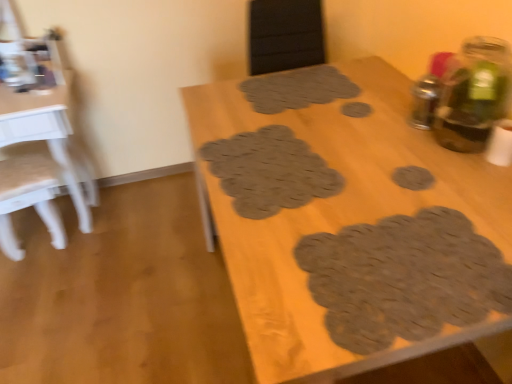
Question: Does brown textured mat at bottom right, marked as the fifth footprint in a top-to-bottom arrangement, appear on the left side of brown textured placemats at center, which is the 1th table from right to left?

Choices:
 (A) no
 (B) yes

Answer: (A)

Question: Does brown textured mat at bottom right, which is the 1th footprint in front-to-back order, have a lesser width compared to brown textured placemats at center, which is the 1th table from right to left?

Choices:
 (A) yes
 (B) no

Answer: (A)

Question: From a real-world perspective, is brown textured mat at bottom right, which is the fifth footprint from back to front, positioned under brown textured placemats at center, which appears as the 2th table when viewed from the left, based on gravity?

Choices:
 (A) yes
 (B) no

Answer: (B)

Question: From the image's perspective, would you say brown textured mat at bottom right, arranged as the first footprint when ordered from the bottom, is shown under brown textured placemats at center, which is the 1th table from right to left?

Choices:
 (A) yes
 (B) no

Answer: (B)

Question: Is brown textured mat at bottom right, arranged as the first footprint when ordered from the bottom, further to camera compared to brown textured placemats at center, which appears as the 2th table when viewed from the left?

Choices:
 (A) no
 (B) yes

Answer: (B)

Question: Is brown textured mat at bottom right, arranged as the first footprint when ordered from the bottom, inside the boundaries of brown textured mat at center, the 5th footprint in the bottom-to-top sequence, or outside?

Choices:
 (A) outside
 (B) inside

Answer: (A)

Question: Does point (446, 291) appear closer or farther from the camera than point (315, 79)?

Choices:
 (A) closer
 (B) farther

Answer: (A)

Question: In the image, is brown textured mat at bottom right, which is the 1th footprint in front-to-back order, positioned in front of or behind brown textured mat at center, which is the first footprint in top-to-bottom order?

Choices:
 (A) front
 (B) behind

Answer: (A)

Question: From a real-world perspective, is brown textured mat at bottom right, which is the 1th footprint in front-to-back order, physically located above or below brown textured mat at center, marked as the first footprint in a back-to-front arrangement?

Choices:
 (A) below
 (B) above

Answer: (A)

Question: Which is correct: brown textured mat at bottom right, arranged as the first footprint when ordered from the bottom, is inside brown textured coaster at center-right, which ranks as the third footprint in back-to-front order, or outside of it?

Choices:
 (A) inside
 (B) outside

Answer: (B)

Question: Does point (373, 261) appear closer or farther from the camera than point (400, 185)?

Choices:
 (A) closer
 (B) farther

Answer: (A)

Question: In terms of width, does brown textured mat at bottom right, marked as the fifth footprint in a top-to-bottom arrangement, look wider or thinner when compared to brown textured coaster at center-right, positioned as the 4th footprint in top-to-bottom order?

Choices:
 (A) wide
 (B) thin

Answer: (A)

Question: From a real-world perspective, is brown textured mat at bottom right, arranged as the first footprint when ordered from the bottom, physically located above or below brown textured coaster at center-right, positioned as the 4th footprint in top-to-bottom order?

Choices:
 (A) below
 (B) above

Answer: (B)

Question: Considering the relative positions of white glossy table at left, marked as the first table in a left-to-right arrangement, and brown textured coaster at center-right, positioned as the 4th footprint in top-to-bottom order, in the image provided, is white glossy table at left, marked as the first table in a left-to-right arrangement, to the left or to the right of brown textured coaster at center-right, positioned as the 4th footprint in top-to-bottom order,?

Choices:
 (A) right
 (B) left

Answer: (B)

Question: Is white glossy table at left, marked as the first table in a left-to-right arrangement, taller or shorter than brown textured coaster at center-right, the third footprint positioned from the front?

Choices:
 (A) short
 (B) tall

Answer: (B)